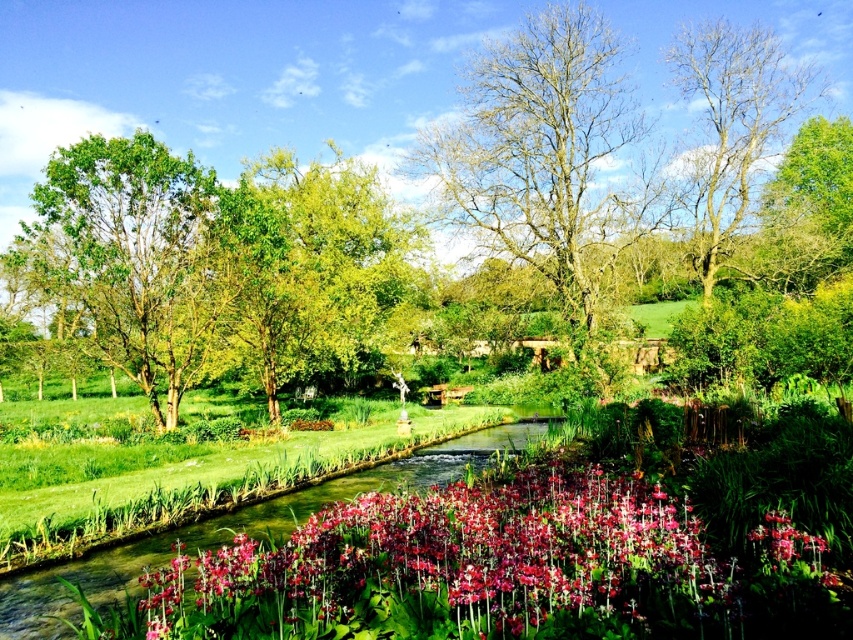
Between point (496, 173) and point (213, 264), which one is positioned in front?

Point (213, 264) is more forward.

Measure the distance between bare wood tree at center and camera.

bare wood tree at center and camera are 30.74 meters apart from each other.

The width and height of the screenshot is (853, 640). What are the coordinates of `bare wood tree at center` in the screenshot? It's located at (546, 157).

Which of these two, clear water at center or pink glossy flower at center, stands taller?

Standing taller between the two is clear water at center.

Is point (24, 586) positioned in front of point (793, 557)?

No, (24, 586) is behind (793, 557).

Is point (149, 554) more distant than point (815, 538)?

Yes.

I want to click on clear water at center, so click(x=238, y=529).

Is pink glossy flowers at center taller than bare wood tree at upper right?

No, pink glossy flowers at center is not taller than bare wood tree at upper right.

The width and height of the screenshot is (853, 640). Find the location of `pink glossy flowers at center`. pink glossy flowers at center is located at coordinates (490, 572).